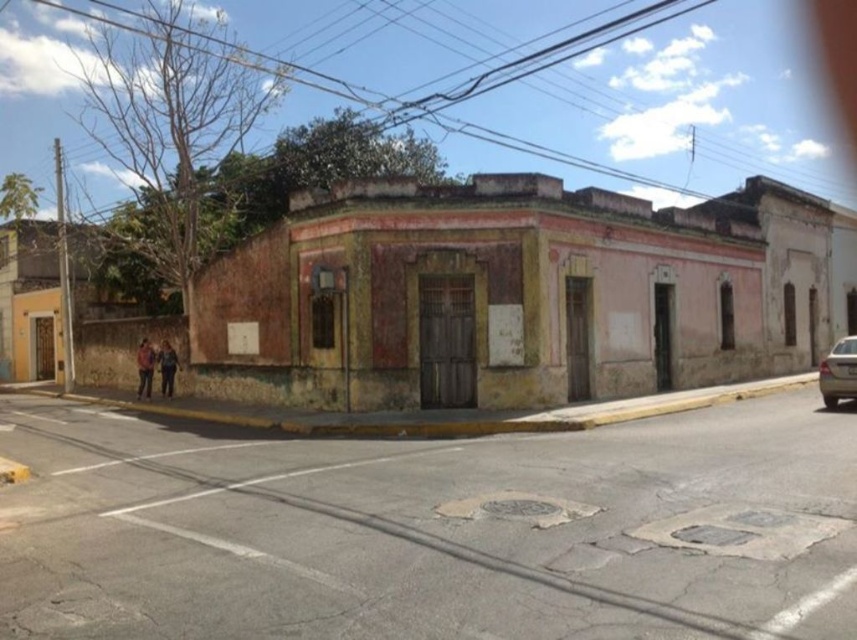
You are a pedestrian standing on the street in front of the building. You see a gold metallic car at right and dark blue jeans at lower left. Which object is located to the right of the other?

The gold metallic car at right is positioned on the right side of dark blue jeans at lower left.

You are standing at the corner of the street scene described. You notice an object located at coordinates point (x=144, y=368). Based on the scene description, what is the object at those coordinates?

The point (x=144, y=368) corresponds to the orange fabric jacket at lower left.